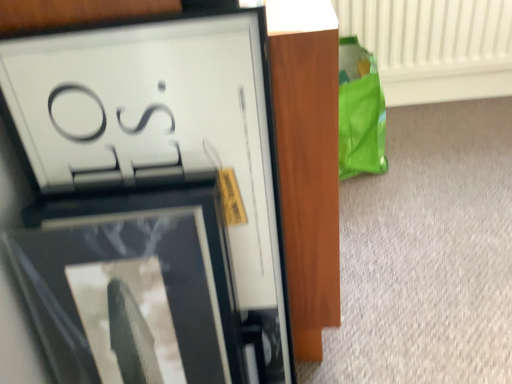
Question: From a real-world perspective, is matte black picture frame at upper left, the 2th picture frame ordered from the bottom, located higher than white textured radiator at upper right?

Choices:
 (A) yes
 (B) no

Answer: (A)

Question: Does matte black picture frame at upper left, the 2th picture frame ordered from the bottom, have a lesser height compared to white textured radiator at upper right?

Choices:
 (A) no
 (B) yes

Answer: (A)

Question: Is matte black picture frame at upper left, the 1th picture frame viewed from the top, oriented away from white textured radiator at upper right?

Choices:
 (A) no
 (B) yes

Answer: (A)

Question: Is the position of matte black picture frame at upper left, the 2th picture frame ordered from the bottom, more distant than that of white textured radiator at upper right?

Choices:
 (A) yes
 (B) no

Answer: (B)

Question: From the image's perspective, is matte black picture frame at upper left, the 2th picture frame ordered from the bottom, on top of white textured radiator at upper right?

Choices:
 (A) no
 (B) yes

Answer: (A)

Question: Based on their sizes in the image, would you say white textured radiator at upper right is bigger or smaller than matte black picture frame at upper left, the 1th picture frame viewed from the top?

Choices:
 (A) big
 (B) small

Answer: (A)

Question: In terms of width, does white textured radiator at upper right look wider or thinner when compared to matte black picture frame at upper left, the 1th picture frame viewed from the top?

Choices:
 (A) wide
 (B) thin

Answer: (A)

Question: Is point (462, 6) positioned closer to the camera than point (276, 208)?

Choices:
 (A) closer
 (B) farther

Answer: (B)

Question: In terms of height, does white textured radiator at upper right look taller or shorter compared to matte black picture frame at upper left, the 2th picture frame ordered from the bottom?

Choices:
 (A) tall
 (B) short

Answer: (B)

Question: Is matte black picture frame at upper left, the 2th picture frame when ordered from top to bottom, bigger or smaller than white textured radiator at upper right?

Choices:
 (A) big
 (B) small

Answer: (B)

Question: Does point (60, 241) appear closer or farther from the camera than point (424, 36)?

Choices:
 (A) farther
 (B) closer

Answer: (B)

Question: From a real-world perspective, relative to white textured radiator at upper right, is matte black picture frame at upper left, the 2th picture frame when ordered from top to bottom, vertically above or below?

Choices:
 (A) below
 (B) above

Answer: (B)

Question: Is matte black picture frame at upper left, the 2th picture frame when ordered from top to bottom, in front of or behind white textured radiator at upper right in the image?

Choices:
 (A) front
 (B) behind

Answer: (A)

Question: Based on their sizes in the image, would you say matte black picture frame at upper left, the 1th picture frame viewed from the top, is bigger or smaller than matte black picture frame at upper left, the 2th picture frame when ordered from top to bottom?

Choices:
 (A) big
 (B) small

Answer: (B)

Question: From the image's perspective, relative to matte black picture frame at upper left, the 2th picture frame when ordered from top to bottom, is matte black picture frame at upper left, the 2th picture frame ordered from the bottom, above or below?

Choices:
 (A) above
 (B) below

Answer: (A)